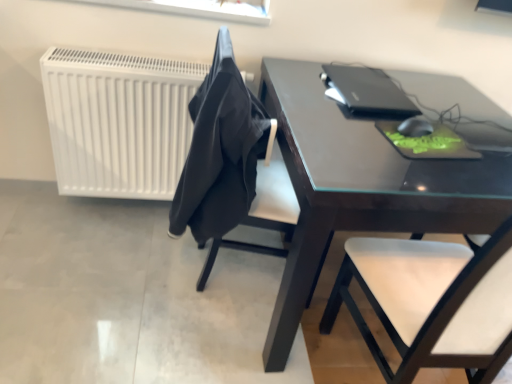
Where is `vacant space underneath black matte laptop at upper right (from a real-world perspective)`? vacant space underneath black matte laptop at upper right (from a real-world perspective) is located at coordinates (358, 81).